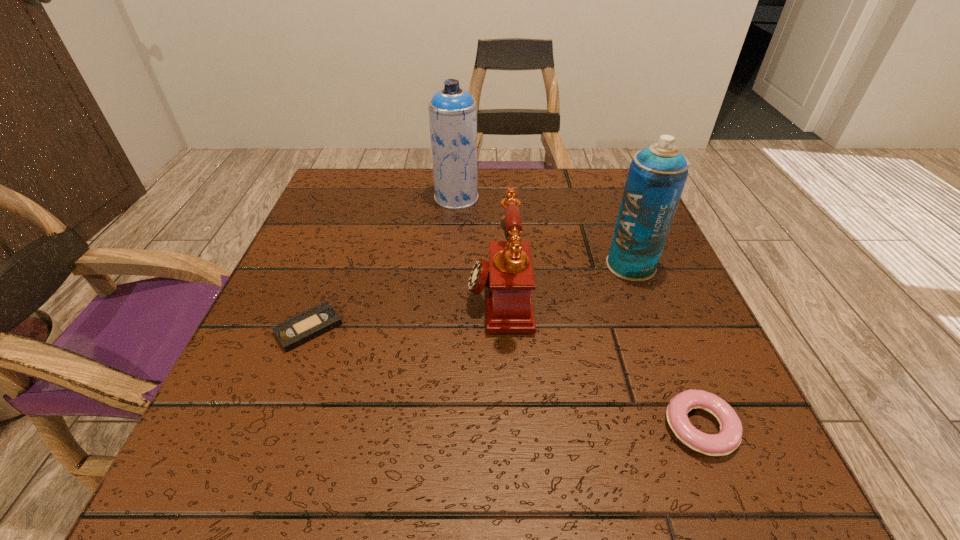
Where is `vacant position located 0.220m on the dial of the telephone`? vacant position located 0.220m on the dial of the telephone is located at coordinates (349, 294).

This screenshot has height=540, width=960. I want to click on vacant space located on the dial of the telephone, so click(425, 294).

You are a GUI agent. You are given a task and a screenshot of the screen. Output one action in this format:
    pyautogui.click(x=<x>, y=<y>)
    Task: Click on the free space located on the dial of the telephone
    This screenshot has height=540, width=960.
    Given the screenshot: What is the action you would take?
    pyautogui.click(x=436, y=294)

Where is `vacant area situated 0.150m on the back of the nearest object`? The height and width of the screenshot is (540, 960). vacant area situated 0.150m on the back of the nearest object is located at coordinates (658, 322).

Identify the location of free space located 0.140m on the back of the shortest object. (336, 256).

Find the location of a particular element. The width and height of the screenshot is (960, 540). object that is at the far edge is located at coordinates (452, 111).

Find the location of a particular element. This screenshot has height=540, width=960. object that is positioned at the near edge is located at coordinates (729, 438).

Find the location of a particular element. object that is at the left edge is located at coordinates (301, 328).

I want to click on aerosol can located at the right edge, so click(x=657, y=175).

You are a GUI agent. You are given a task and a screenshot of the screen. Output one action in this format:
    pyautogui.click(x=<x>, y=<y>)
    Task: Click on the doughnut located at the right edge
    
    Given the screenshot: What is the action you would take?
    (x=729, y=438)